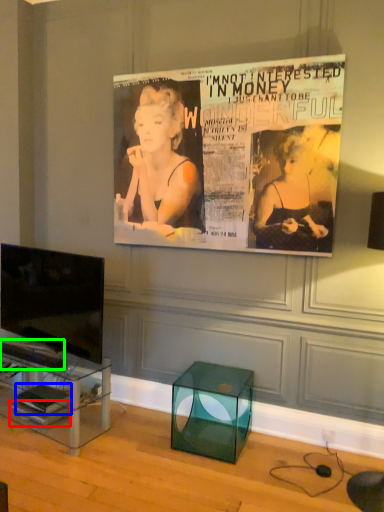
Question: Which object is positioned closest to magazine (highlighted by a red box)? Select from magazine (highlighted by a blue box) and magazine (highlighted by a green box).

Choices:
 (A) magazine
 (B) magazine

Answer: (A)